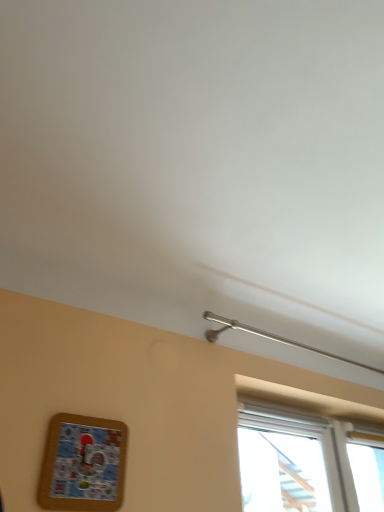
In order to face wooden picture frame at lower left, should I rotate leftwards or rightwards?

You should rotate left by 14.102 degrees.

In order to click on wooden picture frame at lower left in this screenshot , I will do `click(83, 464)`.

Image resolution: width=384 pixels, height=512 pixels. What do you see at coordinates (83, 464) in the screenshot?
I see `wooden picture frame at lower left` at bounding box center [83, 464].

Where is `wooden picture frame at lower left`? This screenshot has height=512, width=384. wooden picture frame at lower left is located at coordinates (83, 464).